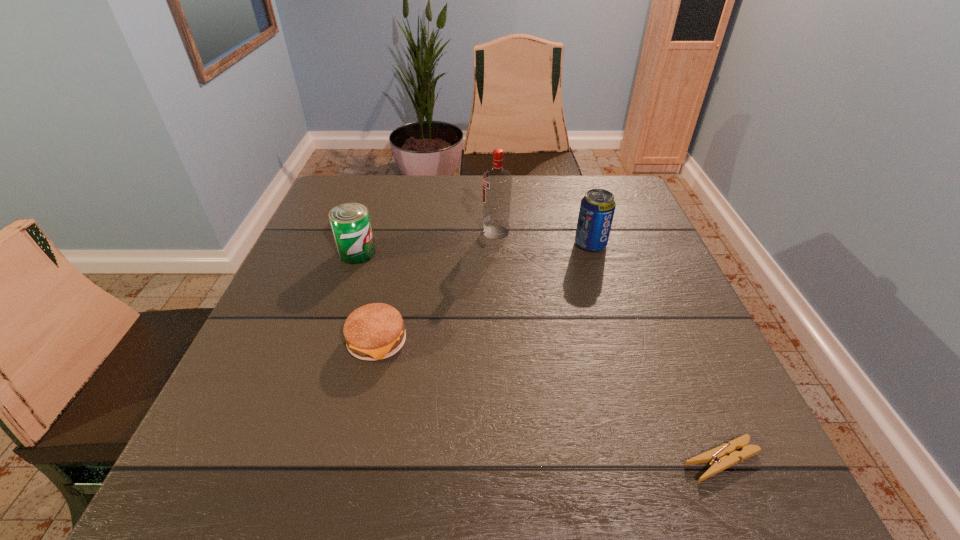
Where is `vacant space that satisfies the following two spatial constraints: 1. on the front side of the shortest object; 2. on the left side of the third tallest object`? vacant space that satisfies the following two spatial constraints: 1. on the front side of the shortest object; 2. on the left side of the third tallest object is located at coordinates (287, 460).